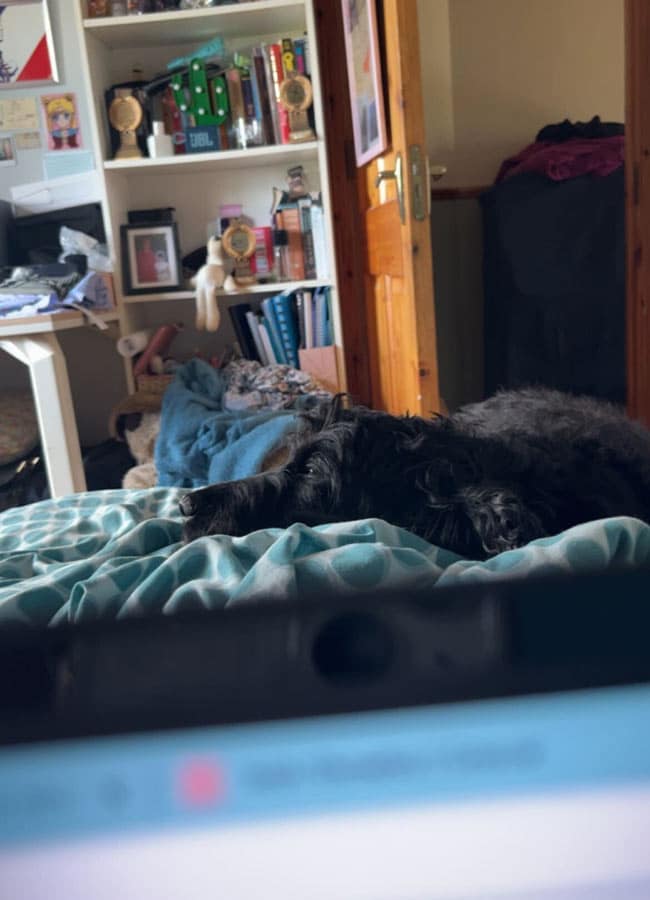
I want to click on grayish silver door handle, so click(x=385, y=173), click(x=439, y=168).